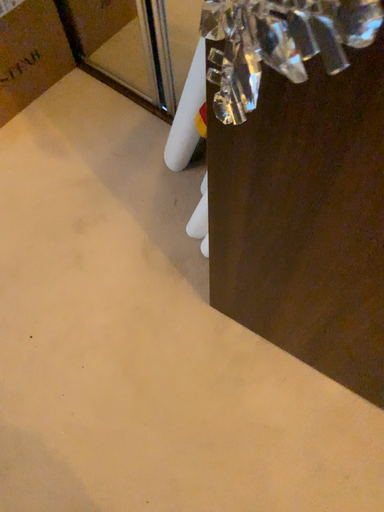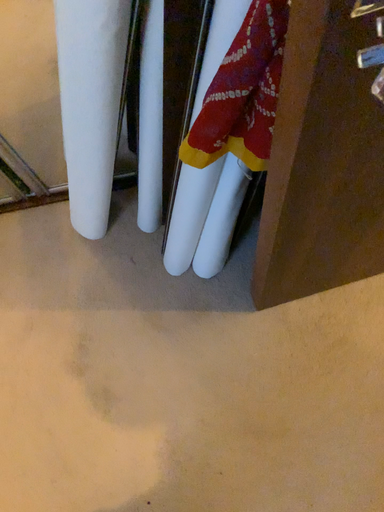
Question: How did the camera likely rotate when shooting the video?

Choices:
 (A) rotated right
 (B) rotated left

Answer: (A)